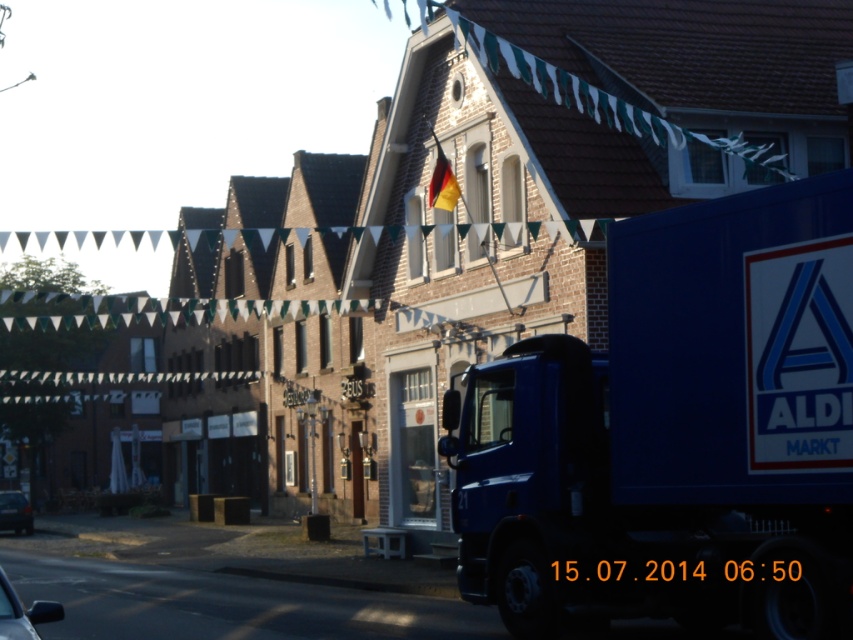
Based on the photo, you are a pedestrian standing on the street and want to take a photo of the German flag at upper center without the blue matte truck at center blocking it. Which direction should you move to ensure the truck is out of the way?

Move to the left side of the blue matte truck at center so that the german flag at upper center becomes visible to the right of the truck.

From the picture: You are standing at the point with coordinates point (27, 524) and want to walk to the point with coordinates point (511, 618). Which direction should you face to walk towards your destination?

You should face north to walk towards point (511, 618) because it is in front of point (27, 524).

You are a photographer who wants to capture both the german flag at upper center and the metallic silver car at lower left in a single shot without moving the camera. Based on their sizes in the frame, which object will appear smaller in the photo?

The german flag at upper center will appear smaller in the photo because it occupies less space than the metallic silver car at lower left.